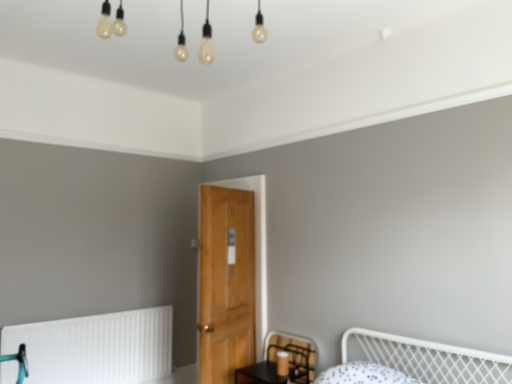
What do you see at coordinates (289, 358) in the screenshot? I see `black mesh swivel chair at lower center` at bounding box center [289, 358].

This screenshot has width=512, height=384. Find the location of `wooden door at center`. wooden door at center is located at coordinates (256, 249).

Does black mesh swivel chair at lower center turn towards wooden door at center?

No, black mesh swivel chair at lower center is not facing towards wooden door at center.

Which of these two, black mesh swivel chair at lower center or wooden door at center, stands shorter?

black mesh swivel chair at lower center is shorter.

Where is `swivel chair below the wooden door at center (from the image's perspective)`? The height and width of the screenshot is (384, 512). swivel chair below the wooden door at center (from the image's perspective) is located at coordinates (289, 358).

Could you tell me if white matte radiator at lower left is turned towards black mesh swivel chair at lower center?

Yes, white matte radiator at lower left is aimed at black mesh swivel chair at lower center.

Does point (34, 375) appear closer or farther from the camera than point (298, 337)?

Point (34, 375) appears to be closer to the viewer than point (298, 337).

In the scene shown: Would you say white matte radiator at lower left is inside or outside black mesh swivel chair at lower center?

white matte radiator at lower left cannot be found inside black mesh swivel chair at lower center.

Looking at this image, is white matte radiator at lower left in front of or behind black mesh swivel chair at lower center in the image?

white matte radiator at lower left is behind black mesh swivel chair at lower center.

Is wooden door at center oriented away from black mesh swivel chair at lower center?

wooden door at center is not turned away from black mesh swivel chair at lower center.

From the image's perspective, which object appears higher, wooden door at center or black mesh swivel chair at lower center?

From the image's view, wooden door at center is above.

Does wooden door at center have a lesser height compared to black mesh swivel chair at lower center?

No.

Is wooden door at center in front of or behind black mesh swivel chair at lower center in the image?

wooden door at center is positioned farther from the viewer than black mesh swivel chair at lower center.

Which of these two, wooden door at center or white matte radiator at lower left, stands shorter?

With less height is white matte radiator at lower left.

Does point (255, 241) come behind point (155, 345)?

No.

Is white matte radiator at lower left completely or partially inside wooden door at center?

No, wooden door at center does not contain white matte radiator at lower left.

Which is behind, white matte radiator at lower left or wooden door at center?

white matte radiator at lower left is behind.

Is white matte radiator at lower left with wooden door at center?

No, white matte radiator at lower left is not beside wooden door at center.

Which object is thinner, white matte radiator at lower left or wooden door at center?

white matte radiator at lower left is thinner.

I want to click on door that appears on the right of white matte radiator at lower left, so click(x=256, y=249).

Based on the photo, from the image's perspective, relative to white matte radiator at lower left, is black mesh swivel chair at lower center above or below?

black mesh swivel chair at lower center is situated higher than white matte radiator at lower left in the image.

Who is more distant, black mesh swivel chair at lower center or white matte radiator at lower left?

white matte radiator at lower left is more distant.

Is black mesh swivel chair at lower center bigger or smaller than white matte radiator at lower left?

Considering their sizes, black mesh swivel chair at lower center takes up less space than white matte radiator at lower left.

You are a GUI agent. You are given a task and a screenshot of the screen. Output one action in this format:
    pyautogui.click(x=<x>, y=<y>)
    Task: Click on the radiator behind the black mesh swivel chair at lower center
    
    Given the screenshot: What is the action you would take?
    pyautogui.click(x=96, y=347)

The height and width of the screenshot is (384, 512). I want to click on swivel chair that appears in front of the wooden door at center, so click(289, 358).

Locate an element on the screen. swivel chair lying on the right of white matte radiator at lower left is located at coordinates (289, 358).

Estimate the real-world distances between objects in this image. Which object is closer to white matte radiator at lower left, wooden door at center or black mesh swivel chair at lower center?

black mesh swivel chair at lower center is closer to white matte radiator at lower left.

Which object lies further to the anchor point white matte radiator at lower left, black mesh swivel chair at lower center or wooden door at center?

The object further to white matte radiator at lower left is wooden door at center.

Looking at the image, which one is located closer to black mesh swivel chair at lower center, white matte radiator at lower left or wooden door at center?

wooden door at center.

Which object lies nearer to the anchor point wooden door at center, white matte radiator at lower left or black mesh swivel chair at lower center?

Based on the image, black mesh swivel chair at lower center appears to be nearer to wooden door at center.

Based on the photo, estimate the real-world distances between objects in this image. Which object is further from wooden door at center, black mesh swivel chair at lower center or white matte radiator at lower left?

white matte radiator at lower left is positioned further to the anchor wooden door at center.

In the scene shown: Looking at the image, which one is located closer to black mesh swivel chair at lower center, wooden door at center or white matte radiator at lower left?

wooden door at center is closer to black mesh swivel chair at lower center.

I want to click on door between white matte radiator at lower left and black mesh swivel chair at lower center in the horizontal direction, so click(256, 249).